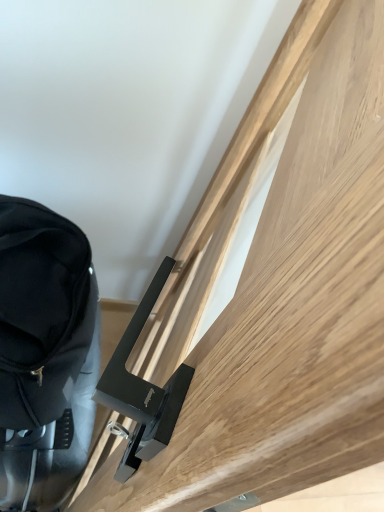
The width and height of the screenshot is (384, 512). What are the coordinates of `black fabric backpack at left` in the screenshot? It's located at (42, 312).

What do you see at coordinates (42, 312) in the screenshot? The image size is (384, 512). I see `black fabric backpack at left` at bounding box center [42, 312].

Locate an element on the screen. This screenshot has width=384, height=512. black fabric backpack at left is located at coordinates (42, 312).